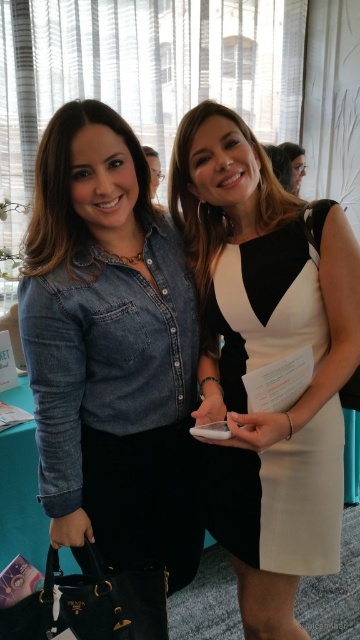
You are standing in the room and want to place a small plant at point (110,349). What object will be displaced by this action?

The denim shirt at left will be displaced because it is located at point (110,349).

You are organizing a photoshoot and need to ensure that the denim shirt at left and the white matte dress at center are visible in the frame. Considering their sizes, which one might require more space in the camera frame?

The denim shirt at left is bigger than the white matte dress at center, so it might require more space in the camera frame.

You are a photographer setting up for a group photo. You see the denim shirt at left and the white matte dress at center in the frame. Which clothing item is positioned more to the left side of the frame?

The denim shirt at left is positioned more to the left side of the frame than the white matte dress at center because it is to the left of it.